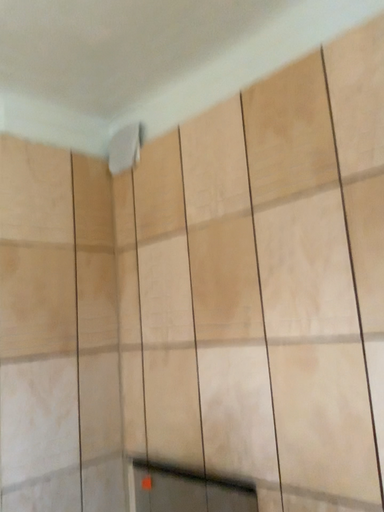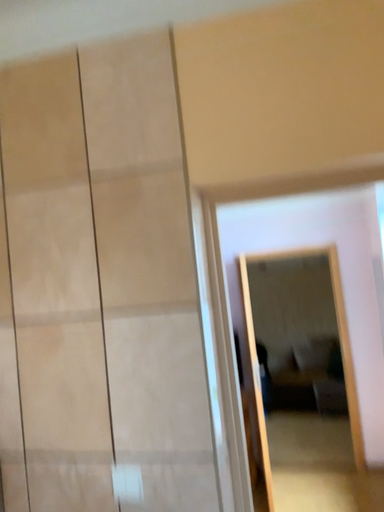
Question: How did the camera likely rotate when shooting the video?

Choices:
 (A) rotated left
 (B) rotated right

Answer: (B)